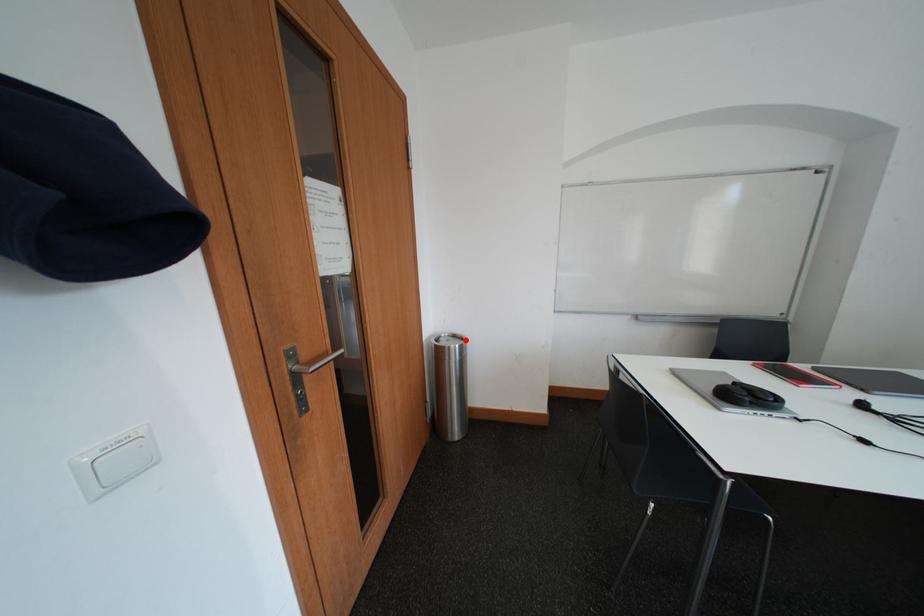
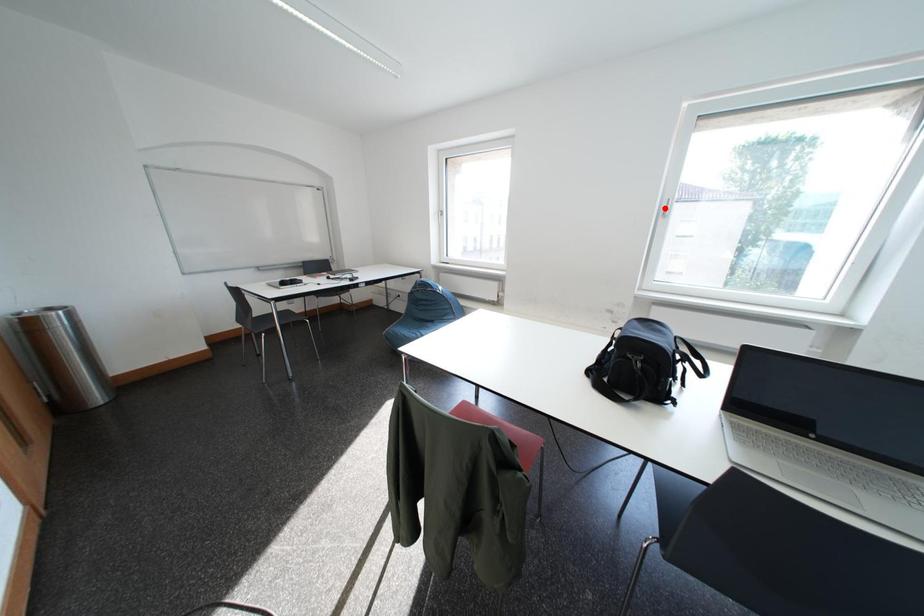
I am providing you with two images of the same scene from different viewpoints. A red point is marked on the first image and another point is marked on the second image. Does the point marked in image1 correspond to the same location as the one in image2?

No